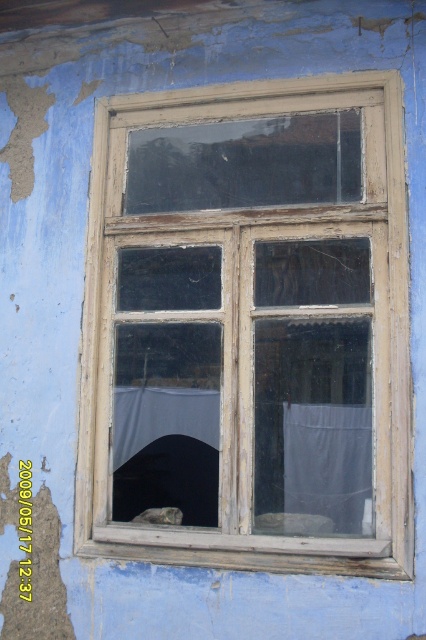
Between weathered wood window frame at center and white sheer curtain at center, which one is positioned higher?

weathered wood window frame at center

How much distance is there between weathered wood window frame at center and white sheer curtain at center?

weathered wood window frame at center is 9.54 inches from white sheer curtain at center.

You are a GUI agent. You are given a task and a screenshot of the screen. Output one action in this format:
    pyautogui.click(x=<x>, y=<y>)
    Task: Click on the weathered wood window frame at center
    This screenshot has width=426, height=640.
    Given the screenshot: What is the action you would take?
    pyautogui.click(x=250, y=326)